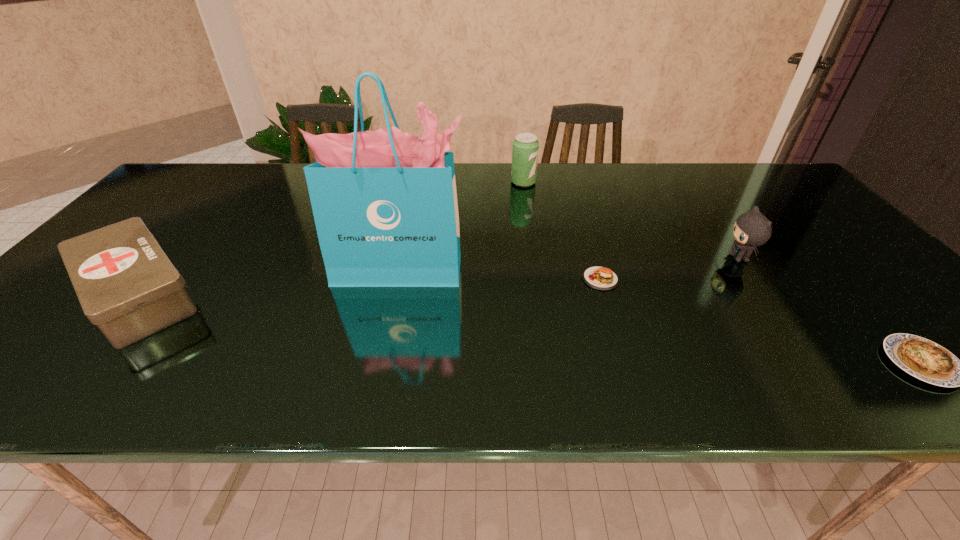
Where is `the fifth object from right to left`? This screenshot has height=540, width=960. the fifth object from right to left is located at coordinates (384, 202).

Image resolution: width=960 pixels, height=540 pixels. I want to click on the tallest object, so click(x=384, y=202).

Locate an element on the screen. The image size is (960, 540). the fourth object from right to left is located at coordinates (525, 150).

Where is `the farthest object`? Image resolution: width=960 pixels, height=540 pixels. the farthest object is located at coordinates (525, 150).

The width and height of the screenshot is (960, 540). Find the location of `kitten`. kitten is located at coordinates (751, 229).

This screenshot has height=540, width=960. Find the location of `the first-aid kit`. the first-aid kit is located at coordinates (127, 286).

Find the location of a particular element. The image size is (960, 540). the third shortest object is located at coordinates (127, 286).

The height and width of the screenshot is (540, 960). I want to click on patty (food), so click(602, 278).

I want to click on free space located 0.240m on the front of the tallest object, so click(380, 369).

Where is `vacant space located on the right of the third object from left to right`? The width and height of the screenshot is (960, 540). vacant space located on the right of the third object from left to right is located at coordinates (654, 183).